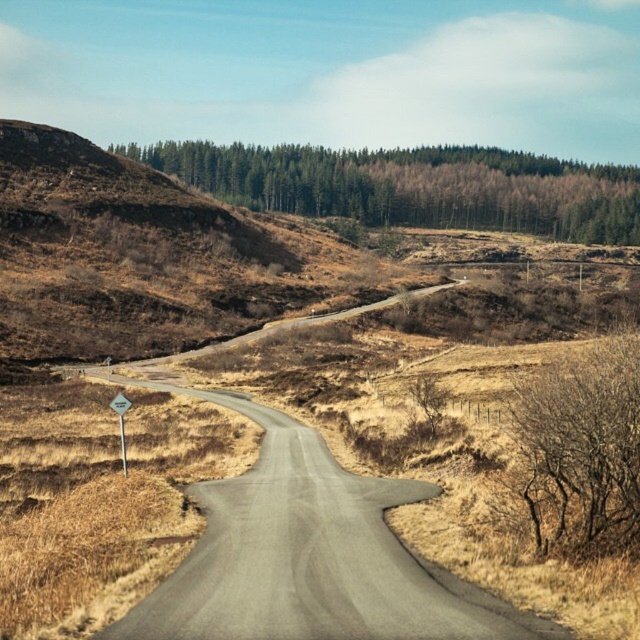
Is gray asphalt road at center bigger than white plastic diamond at left?

Actually, gray asphalt road at center might be smaller than white plastic diamond at left.

Is point (400, 604) closer to camera compared to point (118, 397)?

Yes, it is.

Locate an element on the screen. gray asphalt road at center is located at coordinates (307, 554).

Where is `gray asphalt road at center`? This screenshot has height=640, width=640. gray asphalt road at center is located at coordinates (307, 554).

Does gray asphalt road at center appear under green leafy trees at upper center?

Indeed, gray asphalt road at center is positioned under green leafy trees at upper center.

Between gray asphalt road at center and green leafy trees at upper center, which one has less height?

With less height is gray asphalt road at center.

At what (x,y) coordinates should I click in order to perform the action: click on gray asphalt road at center. Please return your answer as a coordinate pair (x, y). The height and width of the screenshot is (640, 640). Looking at the image, I should click on (307, 554).

This screenshot has height=640, width=640. I want to click on gray asphalt road at center, so click(x=307, y=554).

Is gray asphalt road at center above bare branches at right?

No, gray asphalt road at center is not above bare branches at right.

Which is more to the right, gray asphalt road at center or bare branches at right?

bare branches at right

Who is more distant from viewer, (426, 637) or (636, 541)?

Point (636, 541)

I want to click on gray asphalt road at center, so click(x=307, y=554).